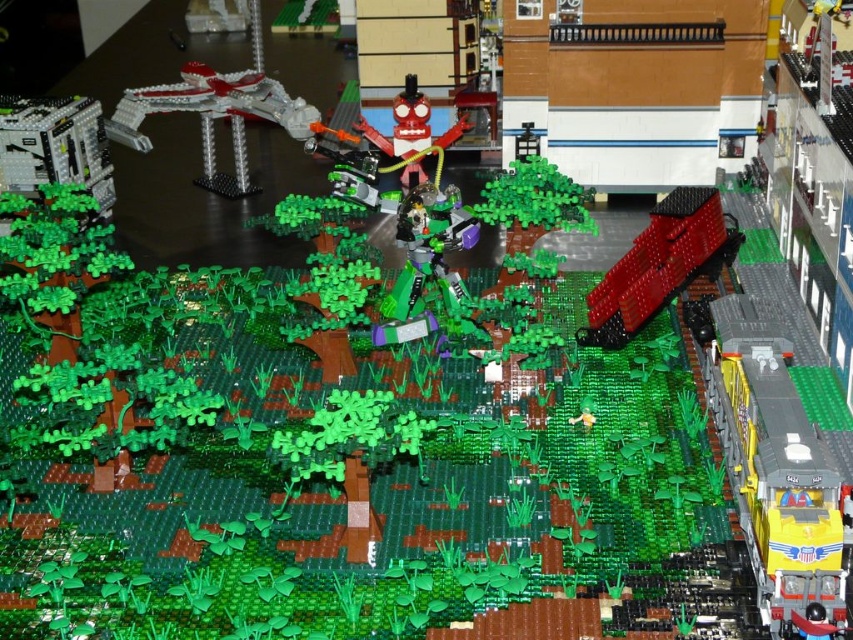
You are a tiny Lego figure standing at the yellow and gray train with a blue stripe. You want to move towards the dense greenery in the foreground. Which of the two points, point (524, 205) or point (403, 100), is closer to your current position?

Point (524, 205) is closer to your current position at the yellow and gray train with a blue stripe because it is in front of point (403, 100).

You are a toy collector who wants to place a new 12 inch tall Lego figure between the shiny metallic spaceship at upper left and the green matte tree at center. Can the figure fit between them without overlapping either object?

The distance between the shiny metallic spaceship at upper left and the green matte tree at center is 24.40 inches. Since the Lego figure is only 12 inches tall, it can fit between them as the space is more than double the figure height, allowing placement without overlapping.